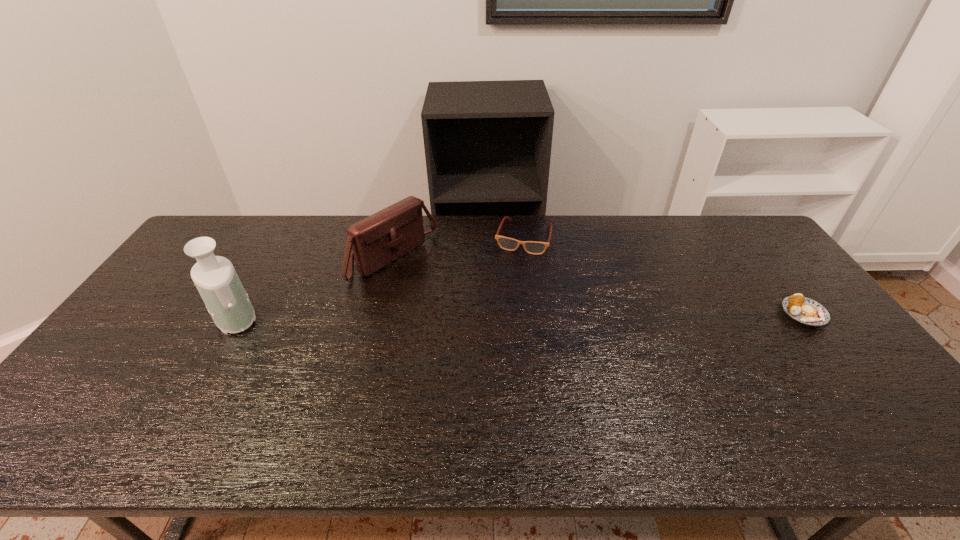
Image resolution: width=960 pixels, height=540 pixels. Identify the location of free region at the near edge of the desktop. (161, 399).

Locate an element on the screen. Image resolution: width=960 pixels, height=540 pixels. vacant region at the left edge of the desktop is located at coordinates (153, 315).

Image resolution: width=960 pixels, height=540 pixels. Find the location of `free space at the far left corner of the desktop`. free space at the far left corner of the desktop is located at coordinates (232, 244).

This screenshot has width=960, height=540. Find the location of `free region at the far right corner`. free region at the far right corner is located at coordinates (755, 237).

Image resolution: width=960 pixels, height=540 pixels. In order to click on free space between the juicer and the rightmost object in this screenshot , I will do `click(518, 315)`.

What are the coordinates of `empty location between the tallest object and the shortest object` in the screenshot? It's located at (518, 315).

The height and width of the screenshot is (540, 960). I want to click on vacant area that lies between the second tallest object and the spectacles, so click(x=458, y=248).

The width and height of the screenshot is (960, 540). Find the location of `empty space that is in between the second tallest object and the pastry`. empty space that is in between the second tallest object and the pastry is located at coordinates (599, 286).

Locate an element on the screen. The image size is (960, 540). empty location between the rightmost object and the third tallest object is located at coordinates (663, 276).

Identify the location of free space between the shoulder bag and the leftmost object. (313, 287).